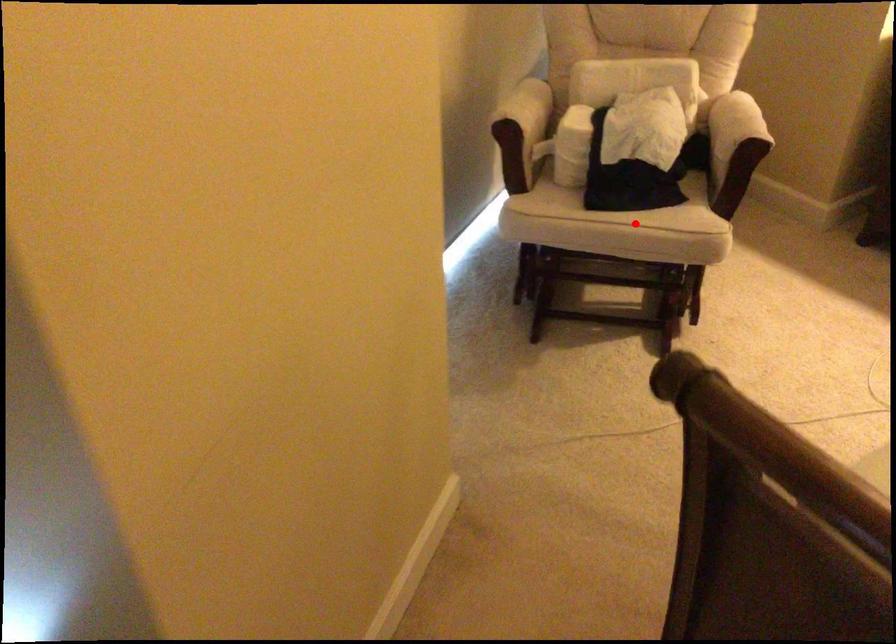
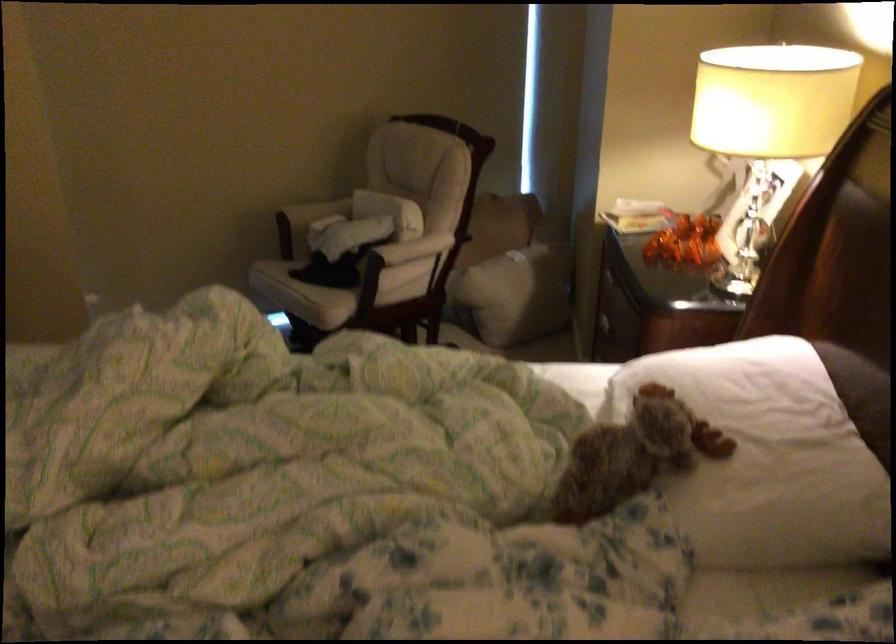
Question: I am providing you with two images of the same scene from different viewpoints. Given a red point in image1, look at the same physical point in image2. Is it:

Choices:
 (A) Closer to the viewpoint
 (B) Farther from the viewpoint

Answer: (B)